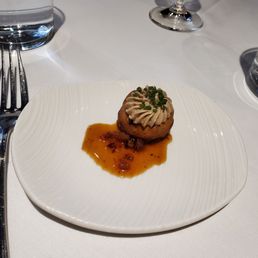
Locate an element on the screen. handle is located at coordinates (3, 173).